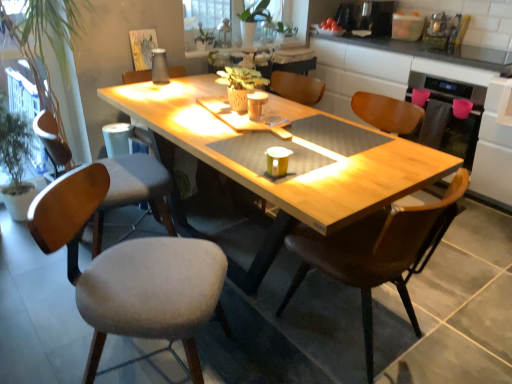
Image resolution: width=512 pixels, height=384 pixels. What do you see at coordinates (277, 161) in the screenshot?
I see `yellow matte coffee cup at center, which is the 1th coffee cup from front to back` at bounding box center [277, 161].

Where is `light gray fabric chair at left, the second chair from the left`? The height and width of the screenshot is (384, 512). light gray fabric chair at left, the second chair from the left is located at coordinates (130, 272).

Where is `green matte plant at upper center, the second houseplant positioned from the bottom`? The width and height of the screenshot is (512, 384). green matte plant at upper center, the second houseplant positioned from the bottom is located at coordinates coord(265,25).

Describe the element at coordinates (377, 252) in the screenshot. I see `brown leather chair at center, placed as the third chair when sorted from left to right` at that location.

Image resolution: width=512 pixels, height=384 pixels. What do you see at coordinates (422, 87) in the screenshot?
I see `wooden counter at upper right` at bounding box center [422, 87].

The height and width of the screenshot is (384, 512). Find the location of `matte brown coffee cup at center, arranged as the second coffee cup when ordered from the bottom`. matte brown coffee cup at center, arranged as the second coffee cup when ordered from the bottom is located at coordinates (256, 105).

Consider the image. Considering the sizes of green leafy plant at left, the second houseplant viewed from the right, and gray fabric chair at left, the 3th chair when ordered from right to left, in the image, is green leafy plant at left, the second houseplant viewed from the right, taller or shorter than gray fabric chair at left, the 3th chair when ordered from right to left,?

In the image, green leafy plant at left, the second houseplant viewed from the right, appears to be taller than gray fabric chair at left, the 3th chair when ordered from right to left.

Is green leafy plant at left, marked as the 1th houseplant in a front-to-back arrangement, at the left side of gray fabric chair at left, the 3th chair when ordered from right to left?

Correct, you'll find green leafy plant at left, marked as the 1th houseplant in a front-to-back arrangement, to the left of gray fabric chair at left, the 3th chair when ordered from right to left.

From the picture: Considering the sizes of objects green leafy plant at left, the 2th houseplant when ordered from back to front, and gray fabric chair at left, positioned as the first chair in left-to-right order, in the image provided, who is smaller, green leafy plant at left, the 2th houseplant when ordered from back to front, or gray fabric chair at left, positioned as the first chair in left-to-right order,?

gray fabric chair at left, positioned as the first chair in left-to-right order, is smaller.

In terms of size, does green leafy plant at left, which is the 1th houseplant in left-to-right order, appear bigger or smaller than yellow matte coffee cup at center, which ranks as the 2th coffee cup in top-to-bottom order?

green leafy plant at left, which is the 1th houseplant in left-to-right order, is bigger than yellow matte coffee cup at center, which ranks as the 2th coffee cup in top-to-bottom order.

Which is more to the right, green leafy plant at left, the 1th houseplant from the bottom, or yellow matte coffee cup at center, which is the first coffee cup in bottom-to-top order?

Positioned to the right is yellow matte coffee cup at center, which is the first coffee cup in bottom-to-top order.

Considering the sizes of objects green leafy plant at left, which is the 1th houseplant in left-to-right order, and yellow matte coffee cup at center, which is the 1th coffee cup from front to back, in the image provided, who is shorter, green leafy plant at left, which is the 1th houseplant in left-to-right order, or yellow matte coffee cup at center, which is the 1th coffee cup from front to back,?

With less height is yellow matte coffee cup at center, which is the 1th coffee cup from front to back.

Based on the photo, does green leafy plant at left, the second houseplant viewed from the right, touch yellow matte coffee cup at center, the second coffee cup from the back?

No, green leafy plant at left, the second houseplant viewed from the right, is not next to yellow matte coffee cup at center, the second coffee cup from the back.

Which point is more distant from viewer, (44,127) or (238,22)?

The point (238,22) is farther.

Consider the image. How different are the orientations of gray fabric chair at left, positioned as the first chair in left-to-right order, and white sheer curtain at upper center in degrees?

81 degrees separate the facing orientations of gray fabric chair at left, positioned as the first chair in left-to-right order, and white sheer curtain at upper center.

Could white sheer curtain at upper center be considered to be inside gray fabric chair at left, positioned as the first chair in left-to-right order?

No, white sheer curtain at upper center is not surrounded by gray fabric chair at left, positioned as the first chair in left-to-right order.

Which object is more forward, gray fabric chair at left, positioned as the first chair in left-to-right order, or white sheer curtain at upper center?

gray fabric chair at left, positioned as the first chair in left-to-right order.

Is wooden counter at upper right in front of or behind matte brown coffee cup at center, placed as the first coffee cup when sorted from back to front, in the image?

Clearly, wooden counter at upper right is behind matte brown coffee cup at center, placed as the first coffee cup when sorted from back to front.

Is there a large distance between wooden counter at upper right and matte brown coffee cup at center, arranged as the first coffee cup when viewed from the top?

Indeed, wooden counter at upper right is not near matte brown coffee cup at center, arranged as the first coffee cup when viewed from the top.

Is point (376, 75) behind point (262, 93)?

Yes.

Does wooden counter at upper right have a larger size compared to matte brown coffee cup at center, the 2th coffee cup viewed from the front?

Yes.

Is gray fabric chair at left, the 3th chair when ordered from right to left, far from wooden counter at upper right?

gray fabric chair at left, the 3th chair when ordered from right to left, is far away from wooden counter at upper right.

You are a GUI agent. You are given a task and a screenshot of the screen. Output one action in this format:
    pyautogui.click(x=<x>, y=<y>)
    Task: Click on the chair that is the 1st object located in front of the wooden counter at upper right
    This screenshot has height=384, width=512.
    Given the screenshot: What is the action you would take?
    pyautogui.click(x=134, y=190)

Is gray fabric chair at left, positioned as the first chair in left-to-right order, situated inside wooden counter at upper right or outside?

gray fabric chair at left, positioned as the first chair in left-to-right order, cannot be found inside wooden counter at upper right.

Is green leafy plant at left, marked as the 1th houseplant in a front-to-back arrangement, shorter than light gray fabric chair at left, the second chair viewed from the right?

Incorrect, the height of green leafy plant at left, marked as the 1th houseplant in a front-to-back arrangement, does not fall short of that of light gray fabric chair at left, the second chair viewed from the right.

Can you confirm if green leafy plant at left, which is the 1th houseplant in left-to-right order, is positioned to the left of light gray fabric chair at left, the second chair viewed from the right?

Yes.

Could you tell me if green leafy plant at left, the 2th houseplant when ordered from back to front, is facing light gray fabric chair at left, the second chair viewed from the right?

Yes, green leafy plant at left, the 2th houseplant when ordered from back to front, is aimed at light gray fabric chair at left, the second chair viewed from the right.

Can you confirm if wooden counter at upper right is positioned to the right of white sheer curtain at upper center?

Yes, wooden counter at upper right is to the right of white sheer curtain at upper center.

Is wooden counter at upper right facing towards white sheer curtain at upper center?

Yes, wooden counter at upper right is turned towards white sheer curtain at upper center.

From the image's perspective, is wooden counter at upper right above white sheer curtain at upper center?

Actually, wooden counter at upper right appears below white sheer curtain at upper center in the image.

Which object is further away from the camera taking this photo, wooden counter at upper right or white sheer curtain at upper center?

white sheer curtain at upper center is more distant.

There is a green leafy plant at left, the second houseplant viewed from the right. Identify the location of the 3rd chair below it (from a real-world perspective). (134, 190).

Find the location of a particular element. The height and width of the screenshot is (384, 512). the 1st coffee cup located above the green leafy plant at left, the 1th houseplant from the bottom (from a real-world perspective) is located at coordinates click(277, 161).

Based on their spatial positions, is green matte plant at upper center, the 2th houseplant viewed from the front, or yellow matte coffee cup at center, which ranks as the 2th coffee cup in top-to-bottom order, further from wooden counter at upper right?

yellow matte coffee cup at center, which ranks as the 2th coffee cup in top-to-bottom order.

Which object lies further to the anchor point matte brown coffee cup at center, arranged as the second coffee cup when ordered from the bottom, gray fabric chair at left, positioned as the first chair in left-to-right order, or white sheer curtain at upper center?

white sheer curtain at upper center lies further to matte brown coffee cup at center, arranged as the second coffee cup when ordered from the bottom, than the other object.

Estimate the real-world distances between objects in this image. Which object is further from green matte plant at upper center, the second houseplant positioned from the bottom, matte brown coffee cup at center, placed as the first coffee cup when sorted from back to front, or wooden counter at upper right?

The object further to green matte plant at upper center, the second houseplant positioned from the bottom, is matte brown coffee cup at center, placed as the first coffee cup when sorted from back to front.

Looking at the image, which one is located closer to brown leather chair at center, placed as the third chair when sorted from left to right, white sheer curtain at upper center or wooden counter at upper right?

wooden counter at upper right.

In the scene shown: From the image, which object appears to be farther from green leafy plant at left, the 1th houseplant from the bottom, brown leather chair at center, placed as the third chair when sorted from left to right, or light gray fabric chair at left, the second chair viewed from the right?

brown leather chair at center, placed as the third chair when sorted from left to right.

Looking at the image, which one is located further to brown leather chair at center, placed as the third chair when sorted from left to right, green matte plant at upper center, the 2th houseplant viewed from the front, or green leafy plant at left, marked as the 1th houseplant in a front-to-back arrangement?

The object further to brown leather chair at center, placed as the third chair when sorted from left to right, is green matte plant at upper center, the 2th houseplant viewed from the front.

From the image, which object appears to be nearer to green leafy plant at left, which is counted as the 2th houseplant, starting from the top, matte brown coffee cup at center, the 2th coffee cup viewed from the front, or wooden counter at upper right?

Among the two, matte brown coffee cup at center, the 2th coffee cup viewed from the front, is located nearer to green leafy plant at left, which is counted as the 2th houseplant, starting from the top.

When comparing their distances from yellow matte coffee cup at center, which is the 1th coffee cup from front to back, does gray fabric chair at left, the 3th chair when ordered from right to left, or matte brown coffee cup at center, the 2th coffee cup viewed from the front, seem further?

gray fabric chair at left, the 3th chair when ordered from right to left, is further to yellow matte coffee cup at center, which is the 1th coffee cup from front to back.

Where is `counter between brown leather chair at center, placed as the first chair when sorted from right to left, and white sheer curtain at upper center from front to back`? The width and height of the screenshot is (512, 384). counter between brown leather chair at center, placed as the first chair when sorted from right to left, and white sheer curtain at upper center from front to back is located at coordinates (422, 87).

At what (x,y) coordinates should I click in order to perform the action: click on chair between brown leather chair at center, placed as the third chair when sorted from left to right, and green matte plant at upper center, arranged as the 1th houseplant when viewed from the back, from front to back. Please return your answer as a coordinate pair (x, y). The height and width of the screenshot is (384, 512). Looking at the image, I should click on (134, 190).

The width and height of the screenshot is (512, 384). Identify the location of chair between gray fabric chair at left, the 3th chair when ordered from right to left, and yellow matte coffee cup at center, which is the first coffee cup in bottom-to-top order, in the horizontal direction. (130, 272).

You are a GUI agent. You are given a task and a screenshot of the screen. Output one action in this format:
    pyautogui.click(x=<x>, y=<y>)
    Task: Click on the houseplant between yellow matte coffee cup at center, the second coffee cup from the back, and green matte plant at upper center, the 2th houseplant viewed from the front, from front to back
    The image size is (512, 384).
    Given the screenshot: What is the action you would take?
    pyautogui.click(x=48, y=42)